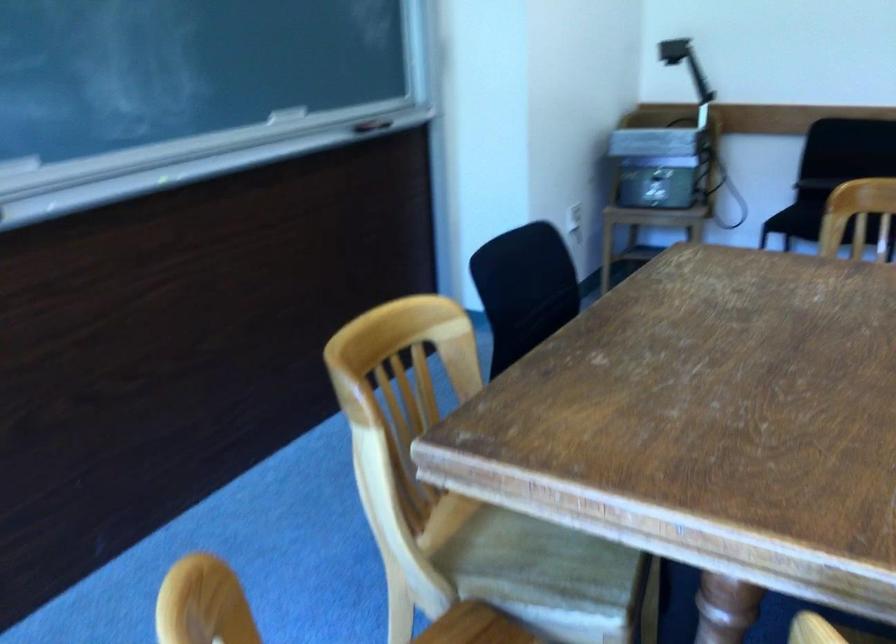
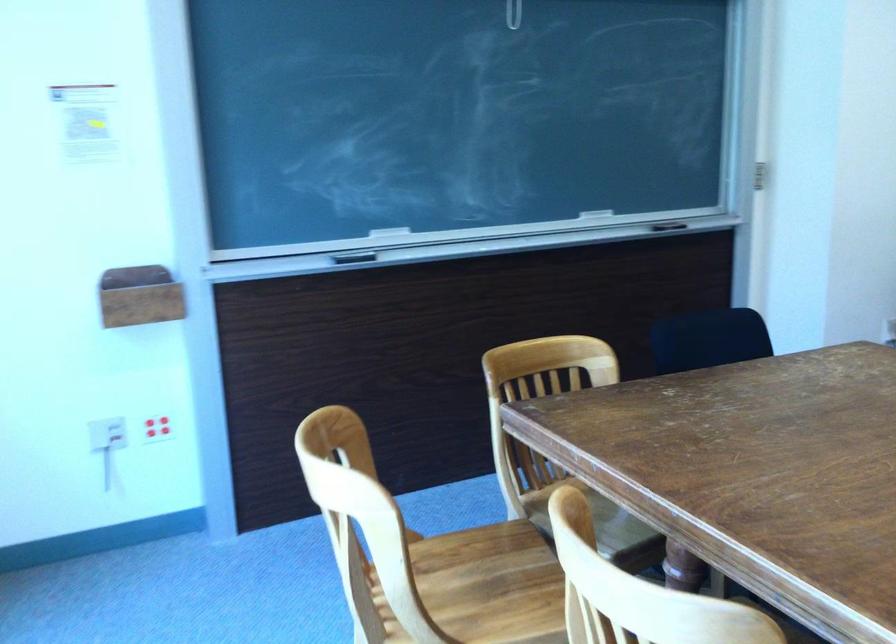
Question: The camera is either moving clockwise (left) or counter-clockwise (right) around the object. The first image is from the beginning of the video and the second image is from the end. Is the camera moving left or right when shooting the video?

Choices:
 (A) Left
 (B) Right

Answer: (B)